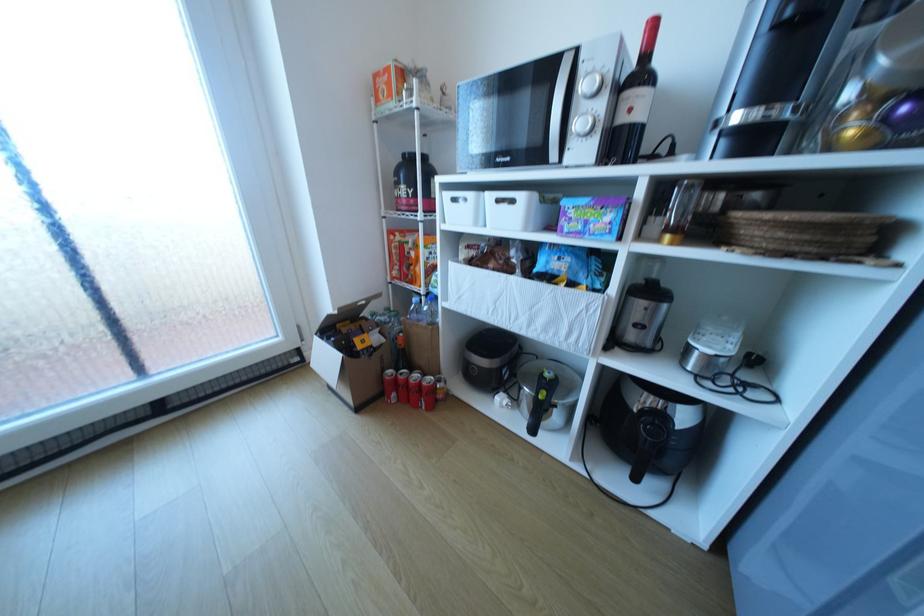
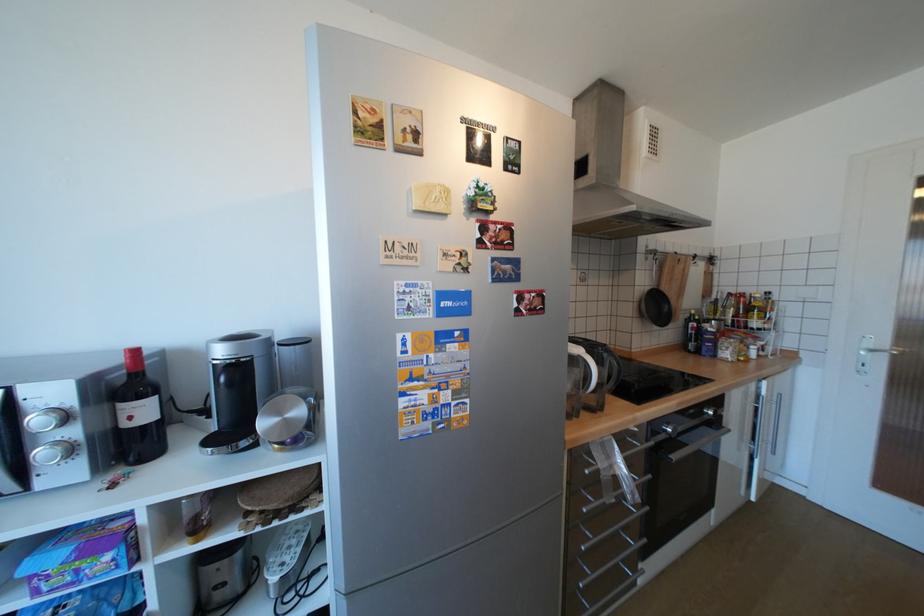
Where in the second image is the point corresponding to point 639,110 from the first image?

(140, 418)